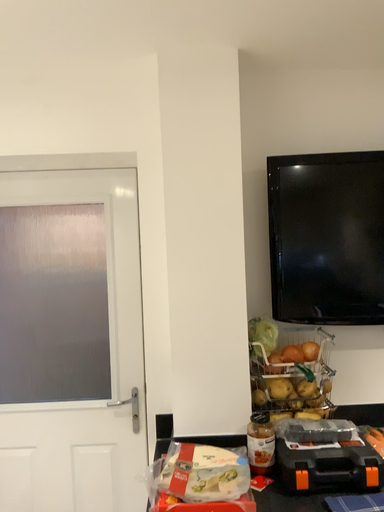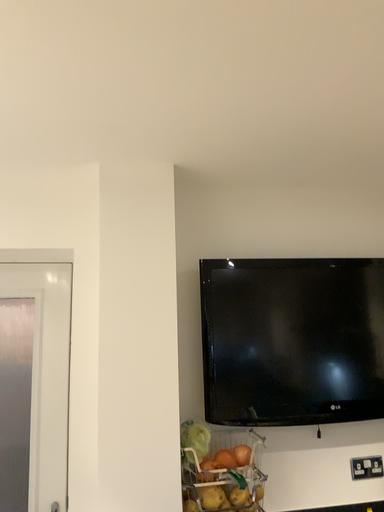
Question: How did the camera likely rotate when shooting the video?

Choices:
 (A) rotated left
 (B) rotated right

Answer: (B)